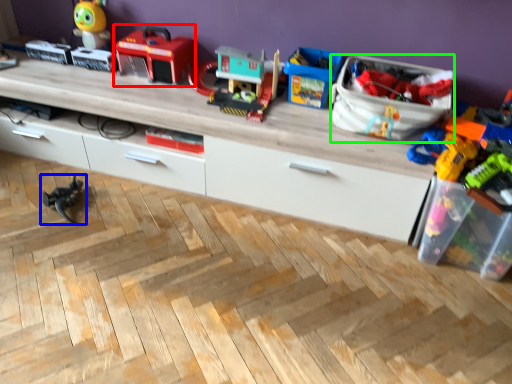
Question: Considering the real-world distances, which object is farthest from toy (highlighted by a red box)? toy (highlighted by a blue box) or storage box (highlighted by a green box)?

Choices:
 (A) toy
 (B) storage box

Answer: (B)